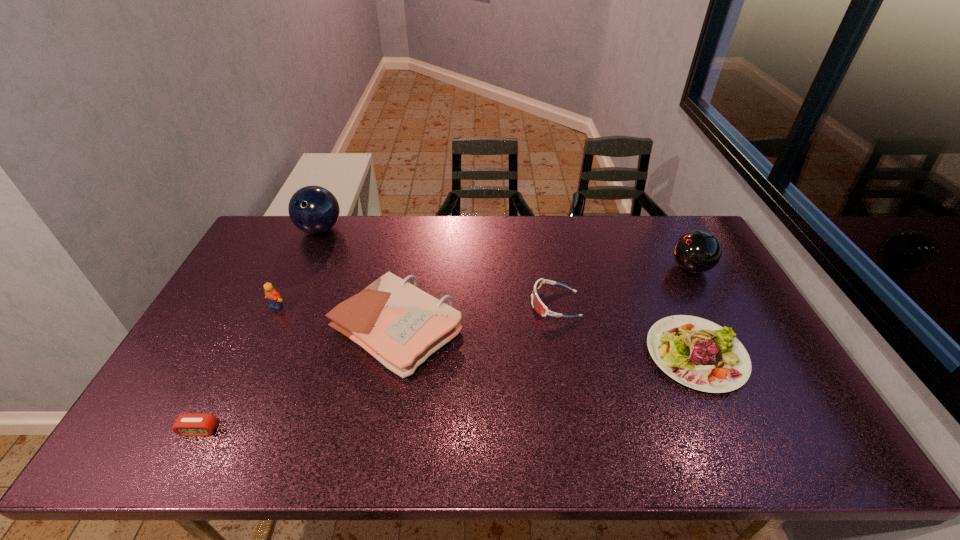
Locate an element on the screen. This screenshot has width=960, height=540. the farthest object is located at coordinates (313, 209).

You are a GUI agent. You are given a task and a screenshot of the screen. Output one action in this format:
    pyautogui.click(x=<x>, y=<y>)
    Task: Click on the tallest object
    This screenshot has height=540, width=960.
    Given the screenshot: What is the action you would take?
    pyautogui.click(x=313, y=209)

You are a GUI agent. You are given a task and a screenshot of the screen. Output one action in this format:
    pyautogui.click(x=<x>, y=<y>)
    Task: Click on the right bowling ball
    This screenshot has width=960, height=540.
    Given the screenshot: What is the action you would take?
    pyautogui.click(x=697, y=251)

The image size is (960, 540). Find the location of `the second farthest object`. the second farthest object is located at coordinates (697, 251).

Find the location of a particular element. The width and height of the screenshot is (960, 540). Lego is located at coordinates (273, 297).

Find the location of a particular element. Image resolution: width=960 pixels, height=540 pixels. the fourth object from right to left is located at coordinates click(400, 325).

Locate an element on the screen. phonebook is located at coordinates (400, 325).

Where is `goggles`? This screenshot has height=540, width=960. goggles is located at coordinates (538, 305).

This screenshot has width=960, height=540. I want to click on salad plate, so click(700, 354).

Identify the location of the shortest object. Image resolution: width=960 pixels, height=540 pixels. (186, 424).